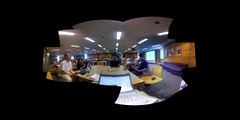
You are a GUI agent. You are given a task and a screenshot of the screen. Output one action in this format:
    pyautogui.click(x=<x>, y=<y>)
    Task: Click on the object on chair
    
    Given the screenshot: What is the action you would take?
    pyautogui.click(x=153, y=77)